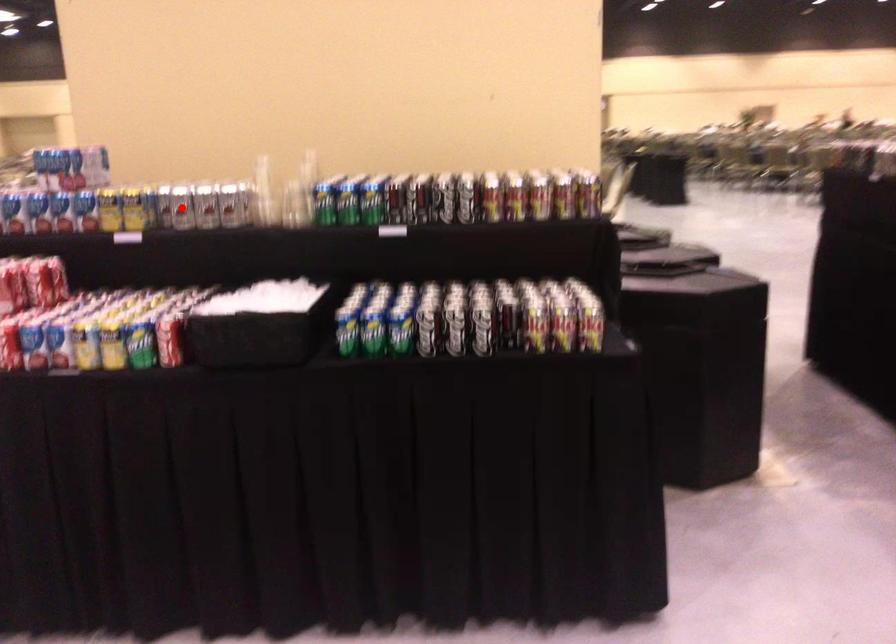
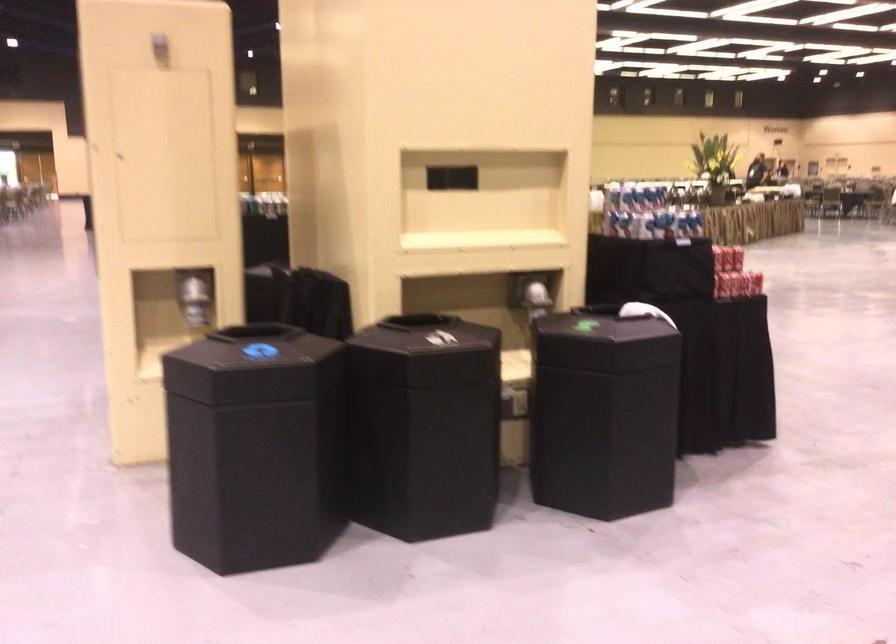
Question: I am providing you with two images of the same scene from different viewpoints. A red point is marked on the first image. Is the red point's position out of view in image 2?

Choices:
 (A) Yes
 (B) No

Answer: (A)